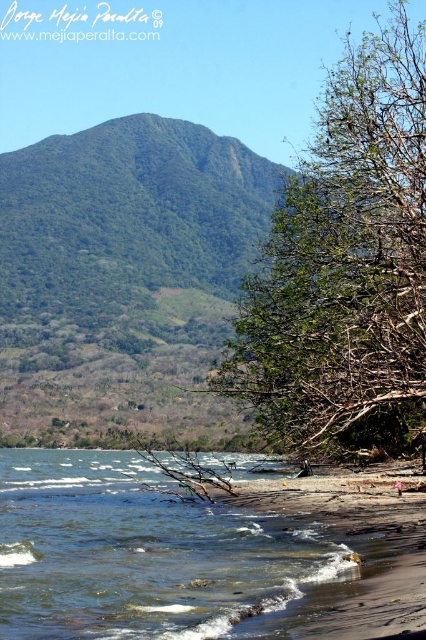
Question: Does green leafy tree at center have a smaller size compared to clear water at lower left?

Choices:
 (A) no
 (B) yes

Answer: (A)

Question: Does green leafy tree at center have a lesser width compared to clear water at lower left?

Choices:
 (A) yes
 (B) no

Answer: (A)

Question: Is the position of green leafy tree at center more distant than that of clear water at lower left?

Choices:
 (A) no
 (B) yes

Answer: (B)

Question: Which point is farther to the camera?

Choices:
 (A) pos(69,612)
 (B) pos(219,390)

Answer: (B)

Question: Which point is closer to the camera taking this photo?

Choices:
 (A) (135, 548)
 (B) (420, 380)

Answer: (B)